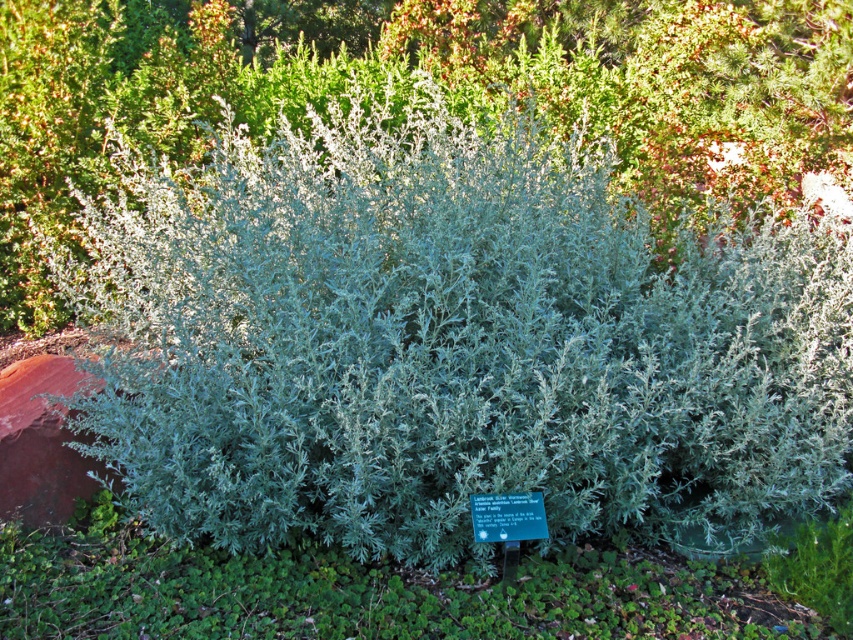
At what (x,y) coordinates should I click in order to perform the action: click on silvery-green foliage at center. Please return your answer as a coordinate pair (x, y). This screenshot has width=853, height=640. Looking at the image, I should click on (407, 77).

Is point (762, 36) farther from viewer compared to point (532, 531)?

Yes, it is behind point (532, 531).

At what (x,y) coordinates should I click in order to perform the action: click on silvery-green foliage at center. Please return your answer as a coordinate pair (x, y). This screenshot has height=640, width=853. Looking at the image, I should click on (407, 77).